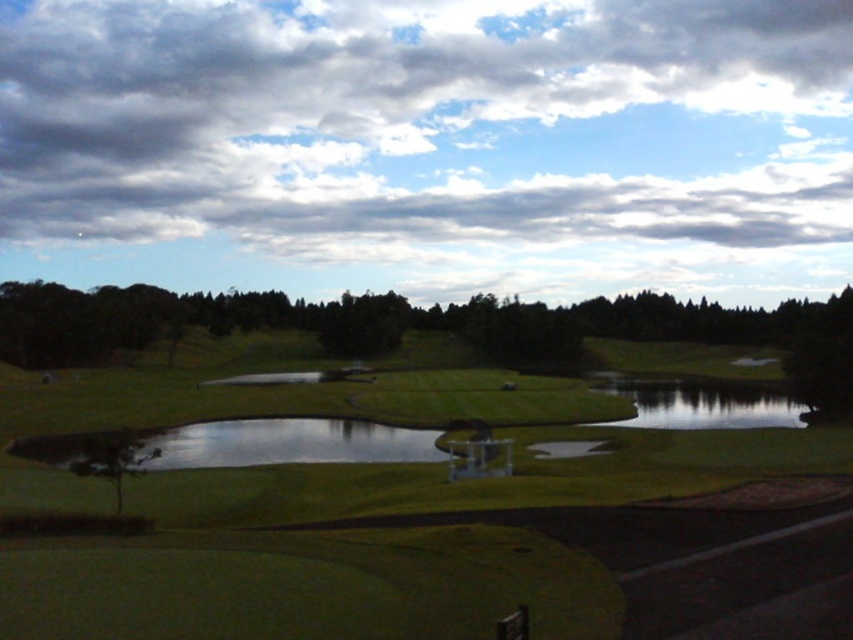
You are standing on the green grassy golf course at center and want to reach the green reflective water at center. Which direction should you move to get there?

You should move downward because the green grassy golf course at center is above the green reflective water at center.

You are a golfer standing on the green grassy golf course at center. You want to hit a ball to the green reflective water at center. Can you reach it in one shot if your average shot distance is 30 meters?

The green grassy golf course at center is 31.56 meters from the green reflective water at center. Since your average shot distance is 30 meters, you cannot reach it in one shot.

You are a golfer standing on the green grass in the foreground of the golf course. You see the green reflective water at center and the green leafy tree at lower left. Which one is wider?

The green reflective water at center is wider than the green leafy tree at lower left.